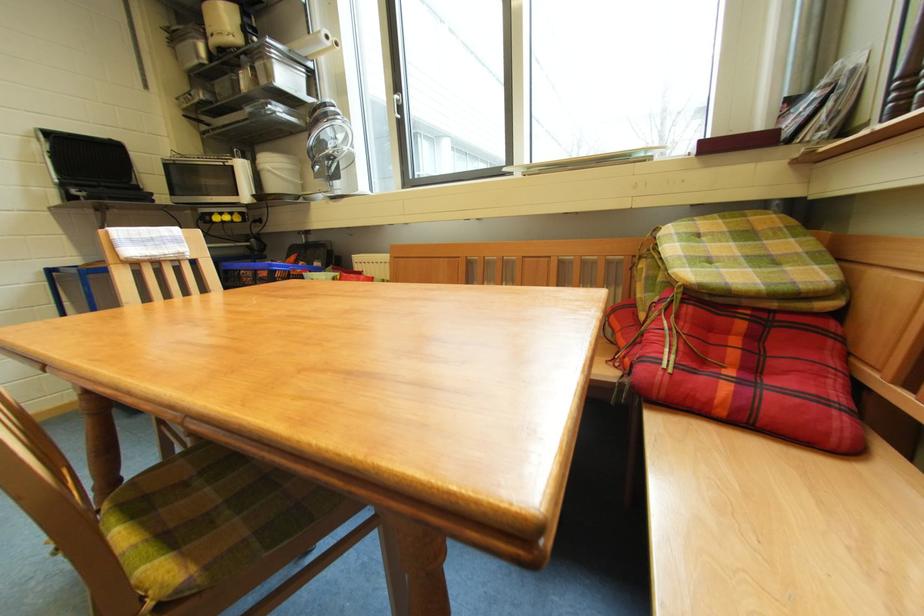
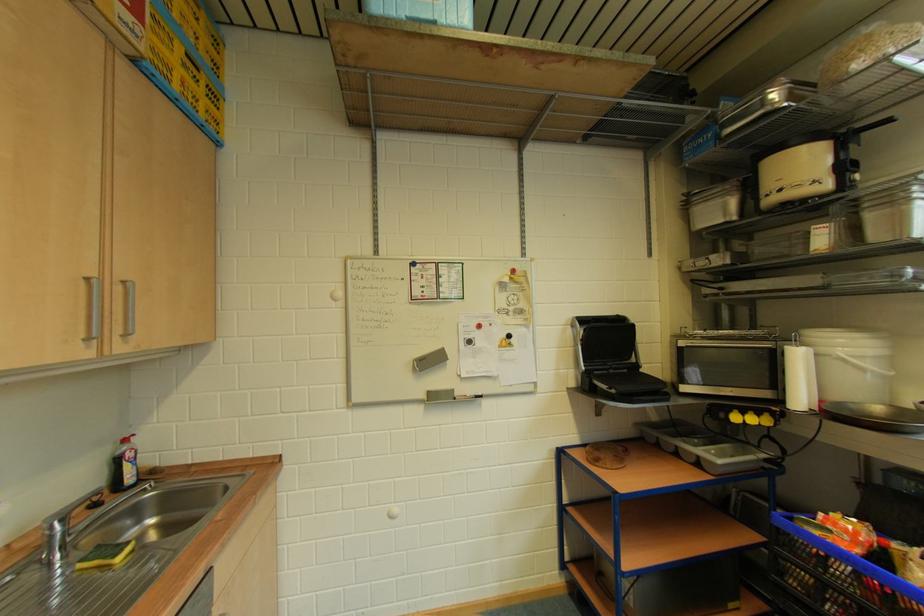
The point at (281, 171) is marked in the first image. Where is the corresponding point in the second image?

(858, 360)